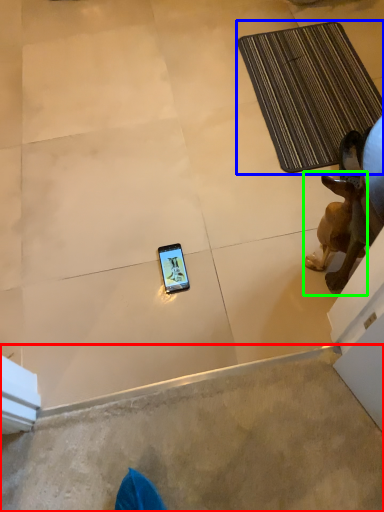
Question: Which is farther away from concrete (highlighted by a red box)? bath mat (highlighted by a blue box) or dog (highlighted by a green box)?

Choices:
 (A) bath mat
 (B) dog

Answer: (A)